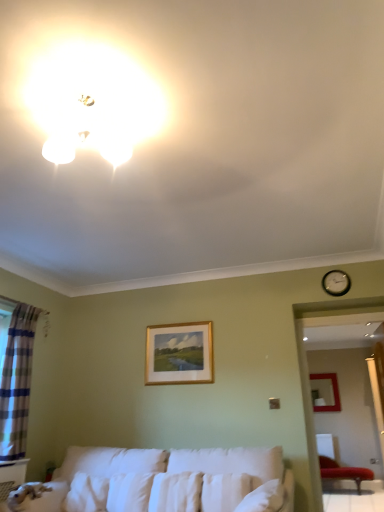
Where is `black metal clock at upper right`? black metal clock at upper right is located at coordinates (336, 283).

What is the approximate width of plaid fabric curtain at left?

It is 7.38 inches.

The width and height of the screenshot is (384, 512). Identify the location of matte gold picture frame at center-right, which ranks as the 2th picture frame in top-to-bottom order. (333, 392).

This screenshot has height=512, width=384. Describe the element at coordinates (343, 472) in the screenshot. I see `velvet red chair at lower right` at that location.

The height and width of the screenshot is (512, 384). In order to click on white fabric couch at lower center in this screenshot , I will do `click(161, 482)`.

Find the location of a particular element. Image resolution: width=384 pixels, height=512 pixels. the 2nd picture frame above the red leather bench at lower right (from a real-world perspective) is located at coordinates (179, 354).

Between red leather bench at lower right and gold wooden picture frame at center, the 1th picture frame positioned from the front, which one has larger width?

With larger width is red leather bench at lower right.

From the image's perspective, is red leather bench at lower right positioned above or below gold wooden picture frame at center, the second picture frame from the back?

Clearly, from the image's perspective, red leather bench at lower right is below gold wooden picture frame at center, the second picture frame from the back.

Which object is closer to the camera taking this photo, red leather bench at lower right or gold wooden picture frame at center, the first picture frame positioned from the top?

red leather bench at lower right is more forward.

From the image's perspective, is matte gold picture frame at center-right, the 1th picture frame from the back, positioned above or below white soft pillow at center, which appears as the second pillow when viewed from the left?

From the image's perspective, matte gold picture frame at center-right, the 1th picture frame from the back, appears below white soft pillow at center, which appears as the second pillow when viewed from the left.

Is matte gold picture frame at center-right, the 1th picture frame from the back, next to white soft pillow at center, which appears as the second pillow when viewed from the left, and touching it?

matte gold picture frame at center-right, the 1th picture frame from the back, and white soft pillow at center, which appears as the second pillow when viewed from the left, are clearly separated.

Consider the image. Considering the positions of objects matte gold picture frame at center-right, the 1th picture frame from the back, and white soft pillow at center, arranged as the first pillow when viewed from the right, in the image provided, who is in front, matte gold picture frame at center-right, the 1th picture frame from the back, or white soft pillow at center, arranged as the first pillow when viewed from the right,?

white soft pillow at center, arranged as the first pillow when viewed from the right, is in front.

Is matte gold picture frame at center-right, which ranks as the 2th picture frame in top-to-bottom order, looking in the opposite direction of white soft pillow at center, arranged as the first pillow when viewed from the right?

matte gold picture frame at center-right, which ranks as the 2th picture frame in top-to-bottom order, is not turned away from white soft pillow at center, arranged as the first pillow when viewed from the right.

Between velvet red chair at lower right and red leather bench at lower right, which one has smaller width?

Thinner between the two is red leather bench at lower right.

Does velvet red chair at lower right turn towards red leather bench at lower right?

Yes, velvet red chair at lower right faces towards red leather bench at lower right.

Which of these two, velvet red chair at lower right or red leather bench at lower right, is smaller?

With smaller size is red leather bench at lower right.

From a real-world perspective, is velvet red chair at lower right positioned over red leather bench at lower right based on gravity?

No.

From a real-world perspective, between plaid fabric curtain at left and white soft pillow at center, which appears as the second pillow when viewed from the left, who is vertically lower?

white soft pillow at center, which appears as the second pillow when viewed from the left, is physically lower.

Between plaid fabric curtain at left and white soft pillow at center, arranged as the first pillow when viewed from the right, which one has more height?

With more height is plaid fabric curtain at left.

From the image's perspective, starting from the plaid fabric curtain at left, which pillow is the 1st one below? Please provide its 2D coordinates.

[(224, 490)]

From the image's perspective, is plaid fabric curtain at left above or below white soft pillow at center, arranged as the first pillow when viewed from the right?

plaid fabric curtain at left is above white soft pillow at center, arranged as the first pillow when viewed from the right.

Where is `picture frame that is the 2nd object located below the matte white light fixture at upper left (from the image's perspective)`? picture frame that is the 2nd object located below the matte white light fixture at upper left (from the image's perspective) is located at coordinates [x=333, y=392].

Which is closer, (70, 81) or (337, 386)?

Point (70, 81) is closer to the camera than point (337, 386).

Who is shorter, matte white light fixture at upper left or matte gold picture frame at center-right, which appears as the 1th picture frame when ordered from the bottom?

matte white light fixture at upper left.

Which of these two, gold wooden picture frame at center, the second picture frame when ordered from bottom to top, or white fabric couch at lower center, is smaller?

gold wooden picture frame at center, the second picture frame when ordered from bottom to top.

From a real-world perspective, is gold wooden picture frame at center, the 1th picture frame positioned from the front, positioned over white fabric couch at lower center based on gravity?

Yes, from a real-world perspective, gold wooden picture frame at center, the 1th picture frame positioned from the front, is on top of white fabric couch at lower center.

Can white fabric couch at lower center be found inside gold wooden picture frame at center, positioned as the 1th picture frame in left-to-right order?

That's incorrect, white fabric couch at lower center is not inside gold wooden picture frame at center, positioned as the 1th picture frame in left-to-right order.

From a real-world perspective, who is located higher, matte white light fixture at upper left or velvet red chair at lower right?

matte white light fixture at upper left, from a real-world perspective.

In the scene shown: Between matte white light fixture at upper left and velvet red chair at lower right, which one has less height?

matte white light fixture at upper left is shorter.

Between matte white light fixture at upper left and velvet red chair at lower right, which one has larger size?

velvet red chair at lower right.

Would you say matte white light fixture at upper left is outside velvet red chair at lower right?

Yes, matte white light fixture at upper left is not within velvet red chair at lower right.

Locate an element on the screen. The image size is (384, 512). bay window that appears below the gold wooden picture frame at center, positioned as the 1th picture frame in left-to-right order (from a real-world perspective) is located at coordinates (308, 376).

From the image's perspective, which pillow is the 2nd one above the matte gold picture frame at center-right, acting as the second picture frame starting from the left? Please provide its 2D coordinates.

[(224, 490)]

Based on their spatial positions, is matte white light fixture at upper left or red leather bench at lower right further from white soft pillow at center, arranged as the first pillow when viewed from the right?

matte white light fixture at upper left.

From the image, which object appears to be nearer to gold wooden picture frame at center, the second picture frame when ordered from bottom to top, red leather bench at lower right or white fabric couch at lower center?

The object closer to gold wooden picture frame at center, the second picture frame when ordered from bottom to top, is white fabric couch at lower center.

In the scene shown: Which object lies further to the anchor point white soft pillow at center, acting as the 2th pillow starting from the right, matte white light fixture at upper left or black metal clock at upper right?

matte white light fixture at upper left.

Estimate the real-world distances between objects in this image. Which object is closer to matte gold picture frame at center-right, the 1th picture frame viewed from the right, red leather bench at lower right or white soft pillow at center, acting as the 2th pillow starting from the right?

red leather bench at lower right.

In the scene shown: Based on their spatial positions, is velvet red chair at lower right or gold wooden picture frame at center, which is the 2th picture frame in right-to-left order, further from red leather bench at lower right?

velvet red chair at lower right lies further to red leather bench at lower right than the other object.

Based on their spatial positions, is white fabric couch at lower center or matte gold picture frame at center-right, positioned as the second picture frame in front-to-back order, further from red leather bench at lower right?

matte gold picture frame at center-right, positioned as the second picture frame in front-to-back order.

Based on their spatial positions, is white soft pillow at center, which appears as the second pillow when viewed from the left, or red leather bench at lower right closer to white soft pillow at center, positioned as the 1th pillow in left-to-right order?

white soft pillow at center, which appears as the second pillow when viewed from the left, is closer to white soft pillow at center, positioned as the 1th pillow in left-to-right order.

Based on their spatial positions, is velvet red chair at lower right or white soft pillow at center, arranged as the first pillow when viewed from the right, further from black metal clock at upper right?

The object further to black metal clock at upper right is velvet red chair at lower right.

Find the location of `bay window between plaid fabric curtain at left and matte gold picture frame at center-right, the 1th picture frame from the back, along the z-axis`. bay window between plaid fabric curtain at left and matte gold picture frame at center-right, the 1th picture frame from the back, along the z-axis is located at coordinates (308, 376).

Locate an element on the screen. bay window located between white soft pillow at center, acting as the 2th pillow starting from the right, and velvet red chair at lower right in the depth direction is located at coordinates (308, 376).

Where is `picture frame between matte white light fixture at upper left and velvet red chair at lower right in the front-back direction`? This screenshot has width=384, height=512. picture frame between matte white light fixture at upper left and velvet red chair at lower right in the front-back direction is located at coordinates (179, 354).

I want to click on lighting located between plaid fabric curtain at left and black metal clock at upper right in the left-right direction, so click(94, 103).